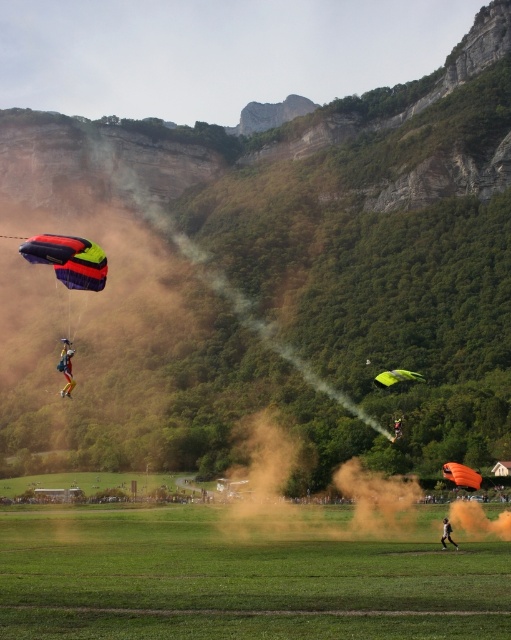
Which is behind, point (474, 468) or point (404, 380)?

The point (474, 468) is more distant.

Between point (454, 477) and point (401, 376), which one is positioned in front?

Point (454, 477) is more forward.

Measure the distance between point (x=447, y=467) and camera.

The distance of point (x=447, y=467) from camera is 81.64 meters.

At what (x,y) coordinates should I click in order to perform the action: click on orange matte parachute at lower right. Please return your answer as a coordinate pair (x, y). Looking at the image, I should click on (461, 476).

Is point (390, 380) behind point (398, 424)?

That is False.

Between green matte parachute at center and orange fabric parachute at center, which one has more height?

orange fabric parachute at center is taller.

Who is more distant from viewer, (389, 380) or (402, 429)?

Point (402, 429)

Where is `green matte parachute at center`? This screenshot has height=640, width=511. green matte parachute at center is located at coordinates (397, 378).

Which is more to the right, green grass field at lower center or green matte parachute at center?

Positioned to the right is green matte parachute at center.

Where is `green grass field at lower center`? This screenshot has height=640, width=511. green grass field at lower center is located at coordinates (238, 580).

The image size is (511, 640). Identify the location of green grass field at lower center. (238, 580).